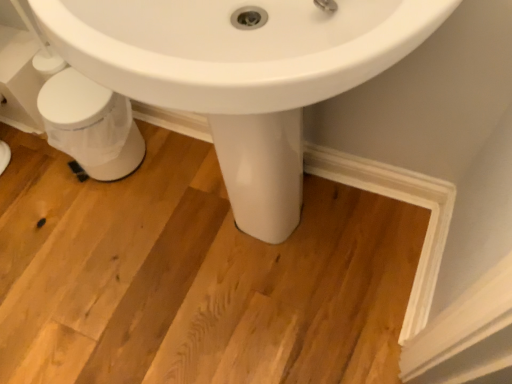
At what (x,y) coordinates should I click in order to perform the action: click on free spot in front of white plastic trash can at lower left. Please return your answer as a coordinate pair (x, y). The image size is (512, 384). Looking at the image, I should click on (106, 216).